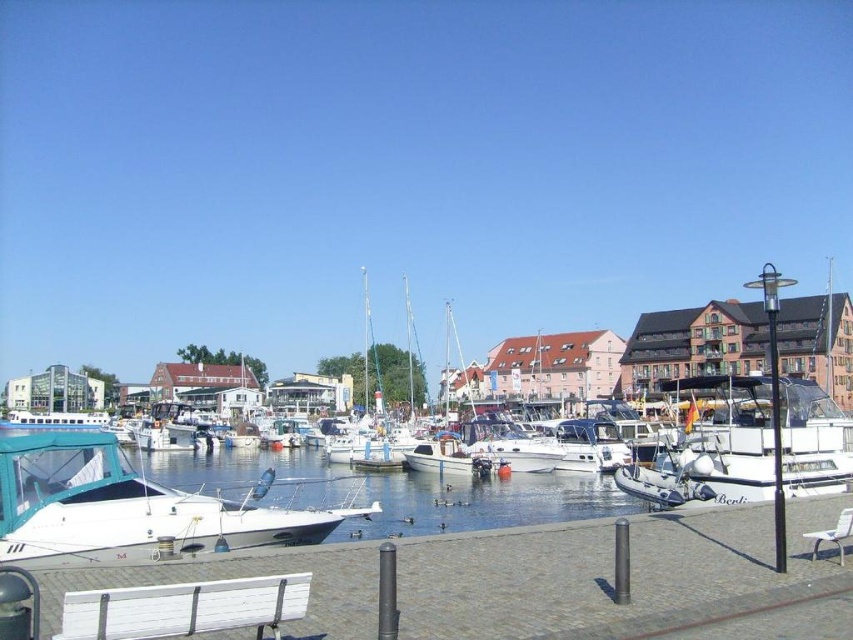
Question: Is the position of teal matte sailboat at lower left more distant than that of white matte boat at center?

Choices:
 (A) no
 (B) yes

Answer: (A)

Question: Which point is closer to the camera?

Choices:
 (A) (810, 532)
 (B) (271, 541)
 (C) (479, 516)
 (D) (434, 444)

Answer: (A)

Question: Can you confirm if teal matte sailboat at lower left is positioned to the left of white plastic park bench at lower right?

Choices:
 (A) yes
 (B) no

Answer: (A)

Question: Can you confirm if white matte boat at center is smaller than white glossy sailboat at center?

Choices:
 (A) yes
 (B) no

Answer: (A)

Question: Considering the real-world distances, which object is farthest from the white matte water at center?

Choices:
 (A) white matte boat at center
 (B) white matte sailboat at center
 (C) teal matte sailboat at lower left

Answer: (A)

Question: Which object appears closest to the camera in this image?

Choices:
 (A) white matte sailboat at center
 (B) teal matte sailboat at lower left
 (C) white matte water at center

Answer: (B)